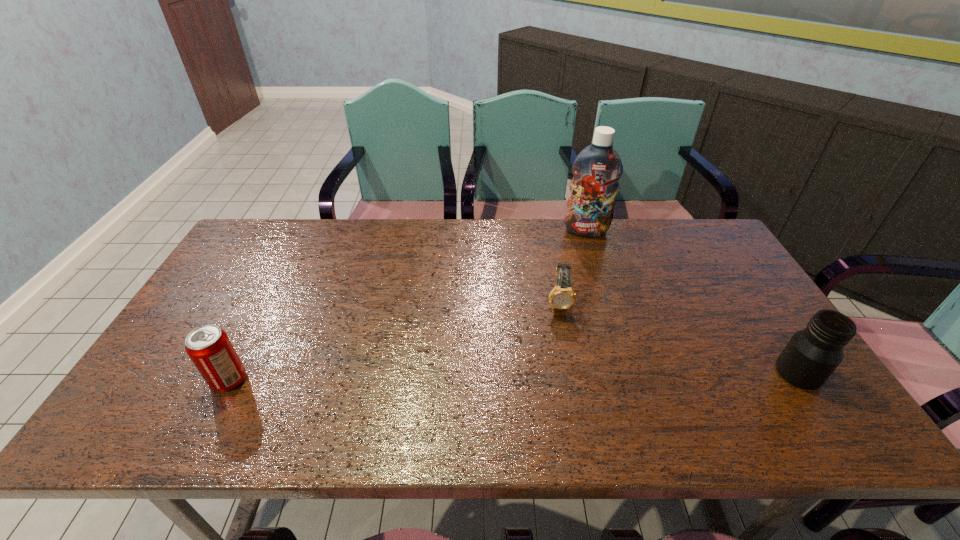
Where is `object present at the near left corner`? object present at the near left corner is located at coordinates (209, 348).

At what (x,y) coordinates should I click in order to perform the action: click on object at the near right corner. Please return your answer as a coordinate pair (x, y). This screenshot has width=960, height=540. Looking at the image, I should click on (812, 354).

Where is `vacant space at the far edge of the desktop`? vacant space at the far edge of the desktop is located at coordinates (435, 246).

The width and height of the screenshot is (960, 540). I want to click on free space at the near edge, so (660, 382).

In the image, there is a desktop. In order to click on free space at the right edge in this screenshot , I will do `click(735, 285)`.

Where is `free space at the far left corner`? This screenshot has height=540, width=960. free space at the far left corner is located at coordinates (253, 238).

In the image, there is a desktop. Identify the location of free space at the near left corner. (171, 372).

Locate an element on the screen. This screenshot has height=540, width=960. vacant point located between the third object from right to left and the rightmost object is located at coordinates (679, 338).

Locate an element on the screen. This screenshot has width=960, height=540. empty space that is in between the watch and the soda can is located at coordinates (394, 341).

Where is `vacant area that lies between the third tallest object and the farthest object`? This screenshot has width=960, height=540. vacant area that lies between the third tallest object and the farthest object is located at coordinates click(407, 306).